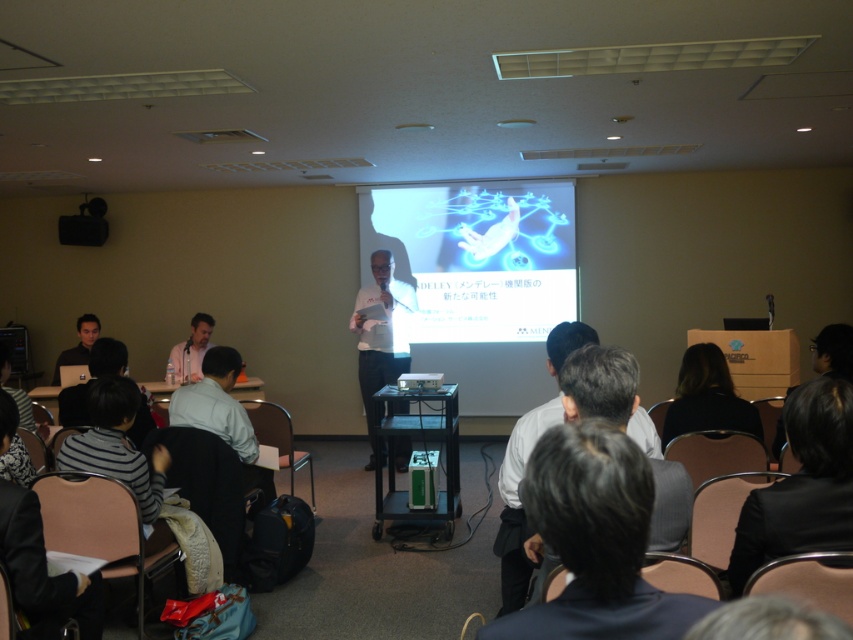
Between black fabric jacket at lower right and black plastic projector at center, which one has more height?

black fabric jacket at lower right

Can you confirm if black fabric jacket at lower right is positioned to the right of black plastic projector at center?

Indeed, black fabric jacket at lower right is positioned on the right side of black plastic projector at center.

You are a GUI agent. You are given a task and a screenshot of the screen. Output one action in this format:
    pyautogui.click(x=<x>, y=<y>)
    Task: Click on the black fabric jacket at lower right
    This screenshot has height=640, width=853.
    Given the screenshot: What is the action you would take?
    pyautogui.click(x=802, y=484)

Is dark gray suit at center taller than black glossy box at lower right?

Indeed, dark gray suit at center has a greater height compared to black glossy box at lower right.

In the scene shown: Who is more forward, (x=589, y=428) or (x=842, y=360)?

Point (x=589, y=428) is more forward.

I want to click on dark gray suit at center, so click(595, 540).

Describe the element at coordinates (518, 500) in the screenshot. The image size is (853, 640). I see `white shirt at center` at that location.

Describe the element at coordinates (518, 500) in the screenshot. This screenshot has width=853, height=640. I see `white shirt at center` at that location.

At what (x,y) coordinates should I click in order to perform the action: click on white shirt at center. Please return your answer as a coordinate pair (x, y). Looking at the image, I should click on (518, 500).